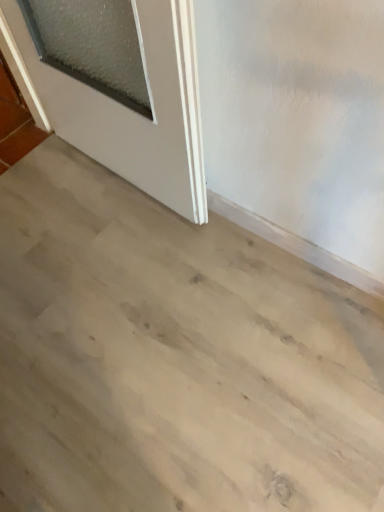
Image resolution: width=384 pixels, height=512 pixels. In order to click on vacant area to the left of white glossy door at upper left in this screenshot , I will do `click(48, 198)`.